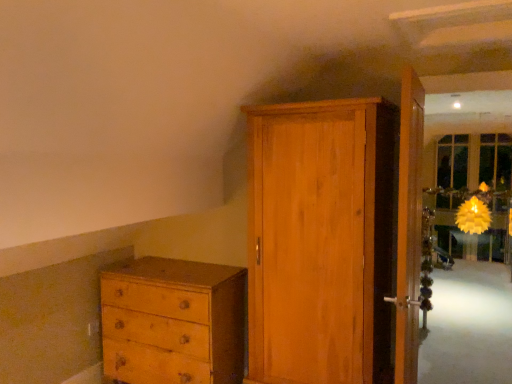
Question: Could you tell me if wooden door at right, acting as the 2th door starting from the left, is turned towards wooden wardrobe at center, the 1th door viewed from the left?

Choices:
 (A) no
 (B) yes

Answer: (B)

Question: Does wooden door at right, acting as the 2th door starting from the left, have a lesser width compared to wooden wardrobe at center, the second door viewed from the right?

Choices:
 (A) no
 (B) yes

Answer: (B)

Question: Is wooden door at right, which is counted as the first door, starting from the right, bigger than wooden wardrobe at center, the second door viewed from the right?

Choices:
 (A) no
 (B) yes

Answer: (A)

Question: Does wooden door at right, which is counted as the first door, starting from the right, have a smaller size compared to wooden wardrobe at center, the 1th door viewed from the left?

Choices:
 (A) yes
 (B) no

Answer: (A)

Question: Is wooden door at right, which is counted as the first door, starting from the right, behind wooden wardrobe at center, the second door viewed from the right?

Choices:
 (A) yes
 (B) no

Answer: (B)

Question: Considering the positions of wooden door at right, acting as the 2th door starting from the left, and wooden wardrobe at center, the 1th door viewed from the left, in the image, is wooden door at right, acting as the 2th door starting from the left, taller or shorter than wooden wardrobe at center, the 1th door viewed from the left,?

Choices:
 (A) short
 (B) tall

Answer: (A)

Question: Based on their sizes in the image, would you say wooden door at right, acting as the 2th door starting from the left, is bigger or smaller than wooden wardrobe at center, the second door viewed from the right?

Choices:
 (A) small
 (B) big

Answer: (A)

Question: Considering the positions of point (402, 112) and point (389, 110), is point (402, 112) closer or farther from the camera than point (389, 110)?

Choices:
 (A) closer
 (B) farther

Answer: (A)

Question: Do you think wooden door at right, which is counted as the first door, starting from the right, is within wooden wardrobe at center, the 1th door viewed from the left, or outside of it?

Choices:
 (A) inside
 (B) outside

Answer: (B)

Question: Which is correct: wooden wardrobe at center, the second door viewed from the right, is inside light brown wood chest of drawers at lower left, or outside of it?

Choices:
 (A) outside
 (B) inside

Answer: (A)

Question: Considering the positions of wooden wardrobe at center, the 1th door viewed from the left, and light brown wood chest of drawers at lower left in the image, is wooden wardrobe at center, the 1th door viewed from the left, bigger or smaller than light brown wood chest of drawers at lower left?

Choices:
 (A) small
 (B) big

Answer: (B)

Question: From the image's perspective, is wooden wardrobe at center, the second door viewed from the right, above or below light brown wood chest of drawers at lower left?

Choices:
 (A) above
 (B) below

Answer: (A)

Question: Does point (267, 192) appear closer or farther from the camera than point (221, 329)?

Choices:
 (A) closer
 (B) farther

Answer: (A)

Question: From a real-world perspective, relative to wooden door at right, acting as the 2th door starting from the left, is light brown wood chest of drawers at lower left vertically above or below?

Choices:
 (A) below
 (B) above

Answer: (A)

Question: From their relative heights in the image, would you say light brown wood chest of drawers at lower left is taller or shorter than wooden door at right, which is counted as the first door, starting from the right?

Choices:
 (A) tall
 (B) short

Answer: (B)